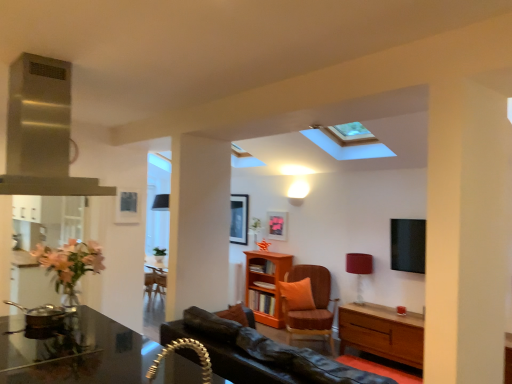
Question: Could you tell me if stainless steel exhaust hood at upper left is facing matte pink picture frame at center?

Choices:
 (A) yes
 (B) no

Answer: (A)

Question: From the image's perspective, is stainless steel exhaust hood at upper left on matte pink picture frame at center?

Choices:
 (A) no
 (B) yes

Answer: (B)

Question: Can you confirm if stainless steel exhaust hood at upper left is thinner than matte pink picture frame at center?

Choices:
 (A) yes
 (B) no

Answer: (B)

Question: Considering the relative positions of stainless steel exhaust hood at upper left and matte pink picture frame at center in the image provided, is stainless steel exhaust hood at upper left to the left of matte pink picture frame at center from the viewer's perspective?

Choices:
 (A) no
 (B) yes

Answer: (B)

Question: Considering the relative sizes of stainless steel exhaust hood at upper left and matte pink picture frame at center in the image provided, is stainless steel exhaust hood at upper left taller than matte pink picture frame at center?

Choices:
 (A) yes
 (B) no

Answer: (A)

Question: Relative to orange fabric pillow at center, is orange textured cushion at center in front or behind?

Choices:
 (A) front
 (B) behind

Answer: (A)

Question: Would you say orange textured cushion at center is inside or outside orange fabric pillow at center?

Choices:
 (A) outside
 (B) inside

Answer: (A)

Question: From their relative heights in the image, would you say orange textured cushion at center is taller or shorter than orange fabric pillow at center?

Choices:
 (A) short
 (B) tall

Answer: (B)

Question: Looking at their shapes, would you say orange textured cushion at center is wider or thinner than orange fabric pillow at center?

Choices:
 (A) thin
 (B) wide

Answer: (B)

Question: Considering the positions of matte pink picture frame at center and wooden bookshelf at center in the image, is matte pink picture frame at center bigger or smaller than wooden bookshelf at center?

Choices:
 (A) small
 (B) big

Answer: (A)

Question: Considering the positions of point (268, 233) and point (258, 294), is point (268, 233) closer or farther from the camera than point (258, 294)?

Choices:
 (A) farther
 (B) closer

Answer: (A)

Question: From the image's perspective, is matte pink picture frame at center above or below wooden bookshelf at center?

Choices:
 (A) above
 (B) below

Answer: (A)

Question: Considering the positions of matte pink picture frame at center and wooden bookshelf at center in the image, is matte pink picture frame at center taller or shorter than wooden bookshelf at center?

Choices:
 (A) tall
 (B) short

Answer: (B)

Question: Is matte red lampshade at right to the left or to the right of shiny black desk at lower left in the image?

Choices:
 (A) right
 (B) left

Answer: (A)

Question: From the image's perspective, is matte red lampshade at right above or below shiny black desk at lower left?

Choices:
 (A) above
 (B) below

Answer: (A)